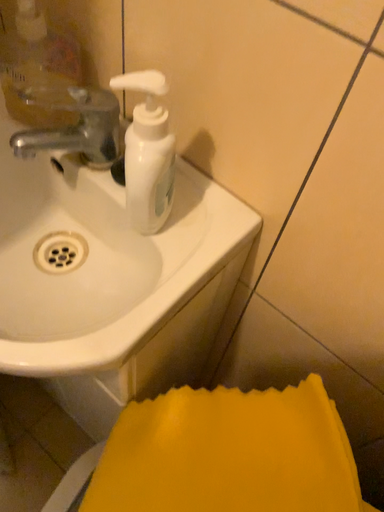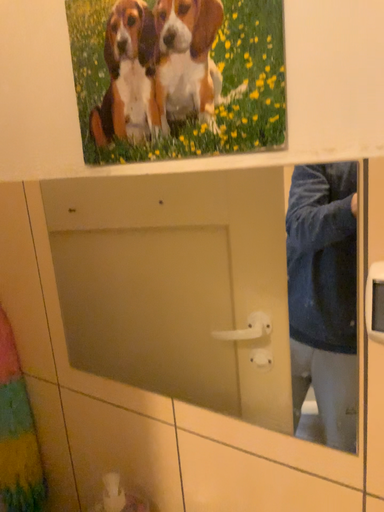
Question: Which way did the camera rotate in the video?

Choices:
 (A) rotated downward
 (B) rotated upward

Answer: (B)